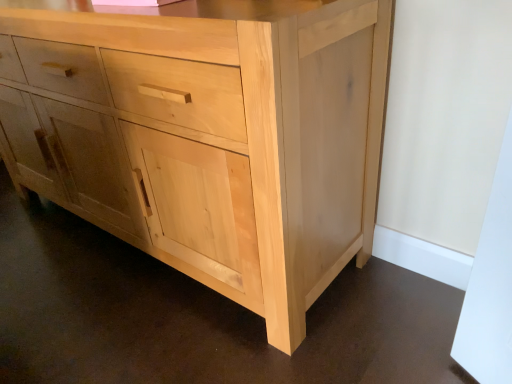
What do you see at coordinates (209, 136) in the screenshot?
I see `natural wood cabinet at center` at bounding box center [209, 136].

Find the location of a particular element. natural wood cabinet at center is located at coordinates (209, 136).

In order to face natural wood cabinet at center, should I rotate leftwards or rightwards?

Turn left approximately 14.400 degrees to face it.

Find the location of a particular element. natural wood cabinet at center is located at coordinates (209, 136).